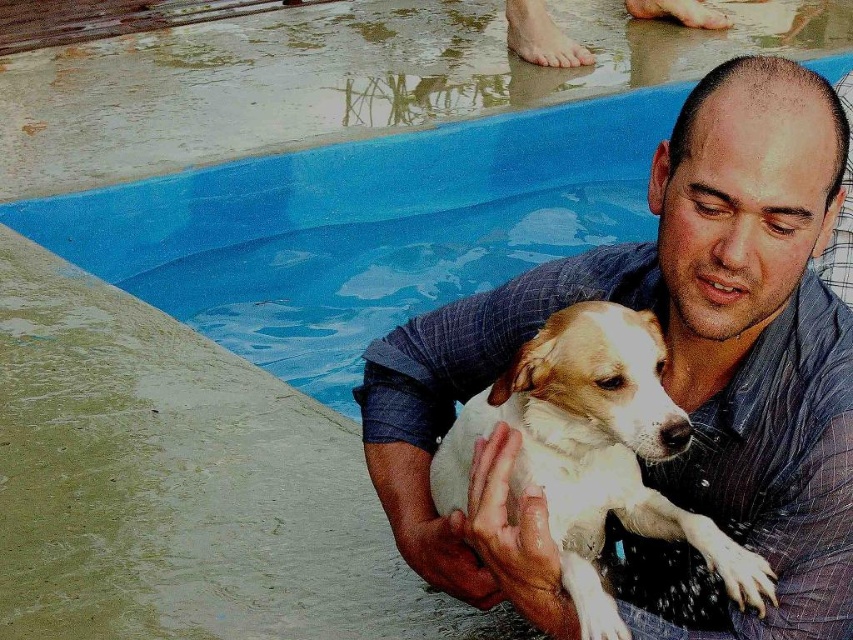
You are a delivery person standing at the edge of the blue plastic swimming pool at upper center. You need to place a package that is 2 meters long on the ground next to the pool. Is there enough space between you and the pool to safely place the package without it falling into the water?

The blue plastic swimming pool at upper center and viewer are 3.52 meters apart from each other. Since the package is 2 meters long, there is sufficient space to place it next to the pool without it falling in.